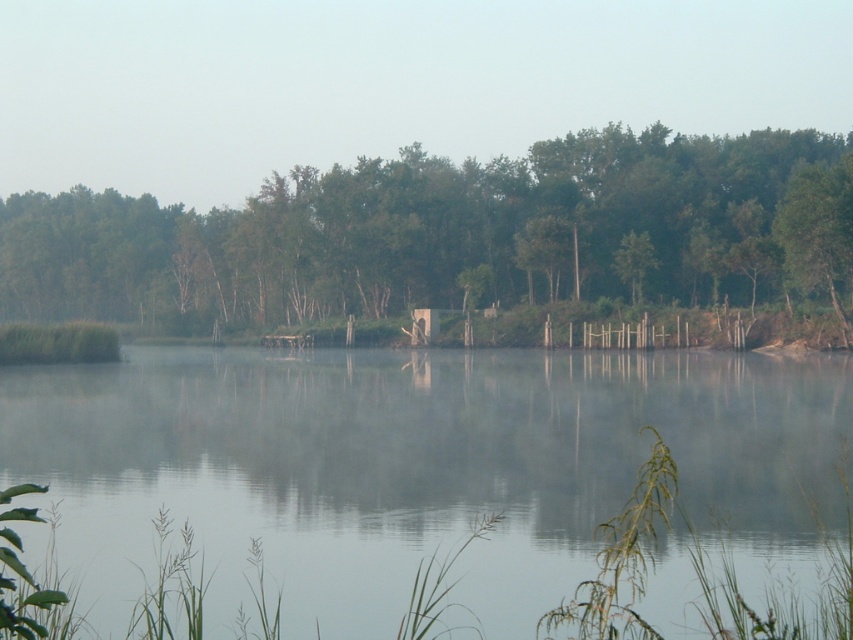
You are an observer standing at the lakeside and see the transparent water at center and the green matte tree at center. Which object is located to the right of the other?

The transparent water at center is positioned on the right side of green matte tree at center.

You are an artist trying to paint this lakeside scene. You want to ensure the transparent water at center and the green matte tree at center are positioned correctly. According to the scene, which object should be placed lower in your painting?

The transparent water at center should be placed lower in the painting because it is below the green matte tree at center according to the description.

You are standing at the edge of the lake in the image. There is a point marked at coordinates (419, 468) which is in the transparent water at center. If you want to walk towards that point, would you be able to see the bottom of the lake clearly through the water?

The point at (419, 468) is in transparent water at center, so yes, you would be able to see the bottom of the lake clearly through the water there.